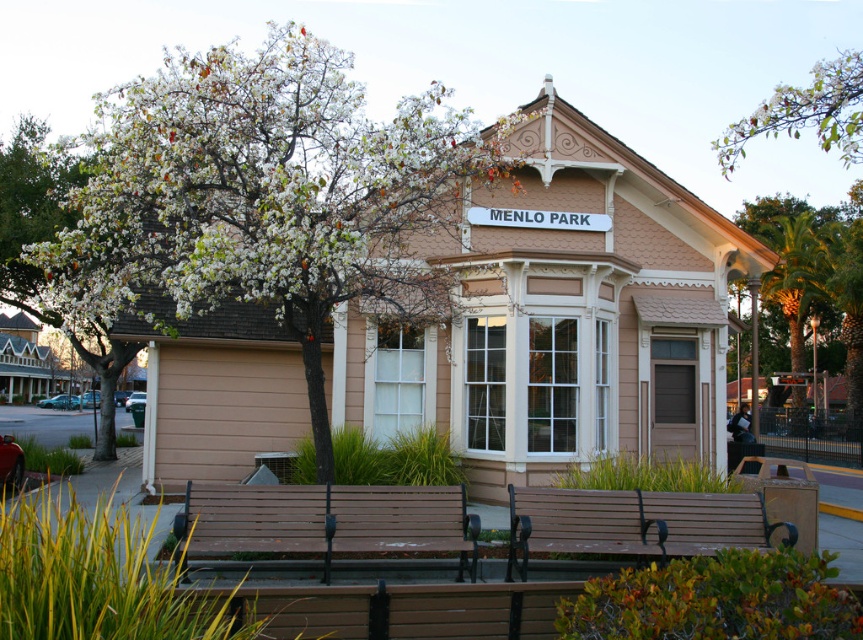
Question: Does white blossoming tree at upper left have a larger size compared to white blossoms at left?

Choices:
 (A) no
 (B) yes

Answer: (B)

Question: Which object is the closest to the white blossoms at upper center?

Choices:
 (A) brown wood bench at center
 (B) brown wooden bench at lower center
 (C) white blossoms at left

Answer: (B)

Question: Can you confirm if brown wooden bench at lower center is positioned below white blossoms at left?

Choices:
 (A) no
 (B) yes

Answer: (B)

Question: Based on their relative distances, which object is farther from the white blossoms at left?

Choices:
 (A) white blossoms at upper center
 (B) brown wood bench at center
 (C) white blossoming tree at upper left

Answer: (A)

Question: Can you confirm if white blossoming tree at upper left is positioned to the right of green leafy palm at right?

Choices:
 (A) yes
 (B) no

Answer: (B)

Question: Among these objects, which one is farthest from the camera?

Choices:
 (A) white blossoms at left
 (B) white blossoming tree at upper left
 (C) brown wood bench at center

Answer: (A)